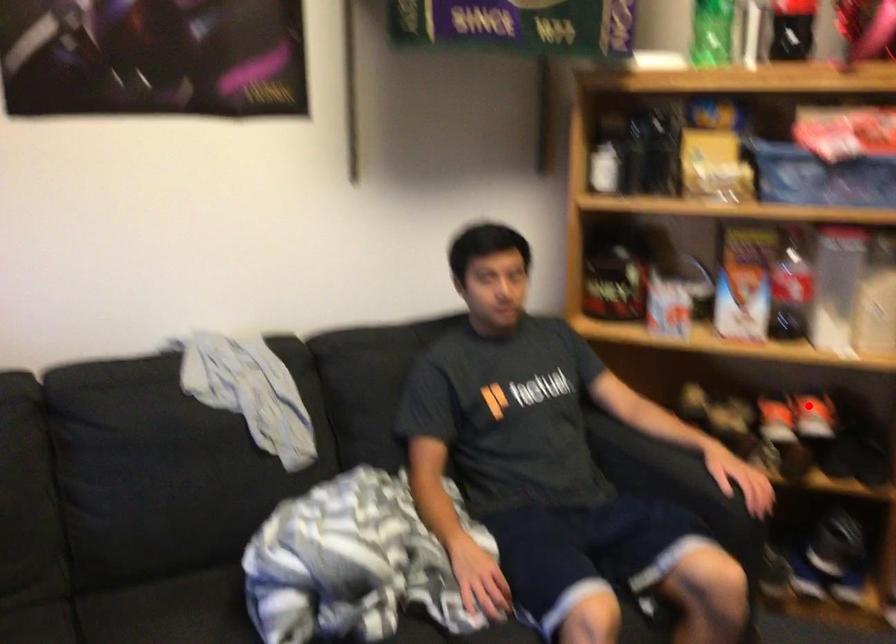
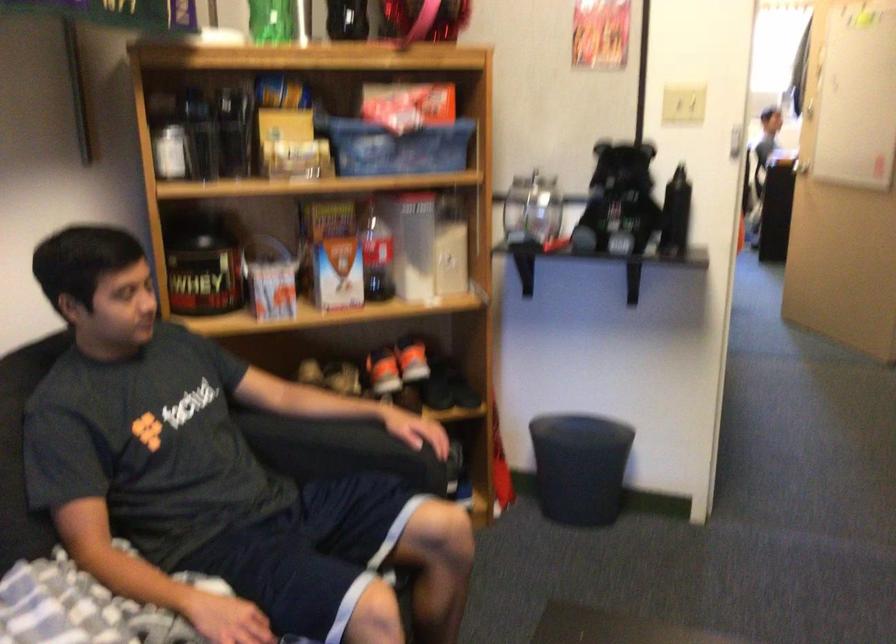
In the second image, find the point that corresponds to the highlighted location in the first image.

(411, 359)